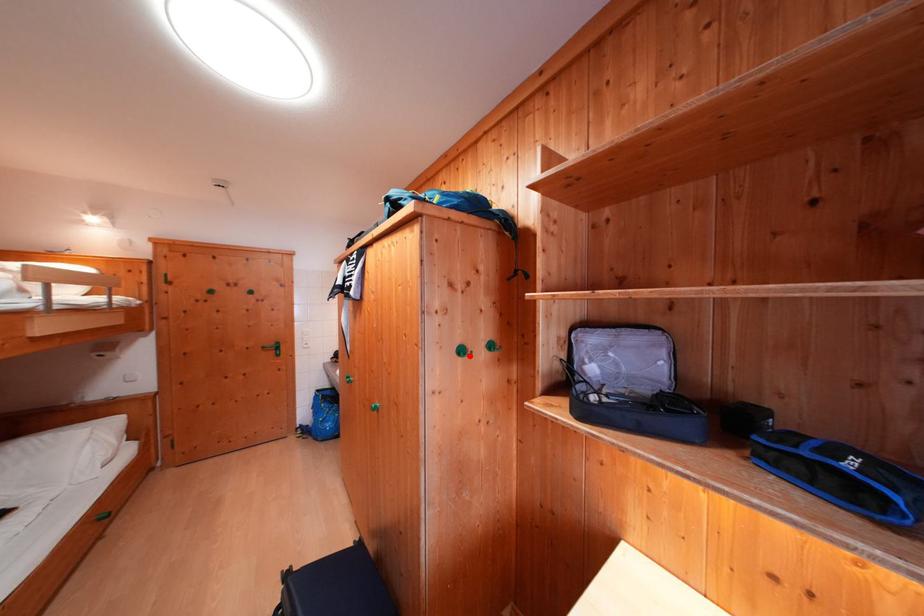
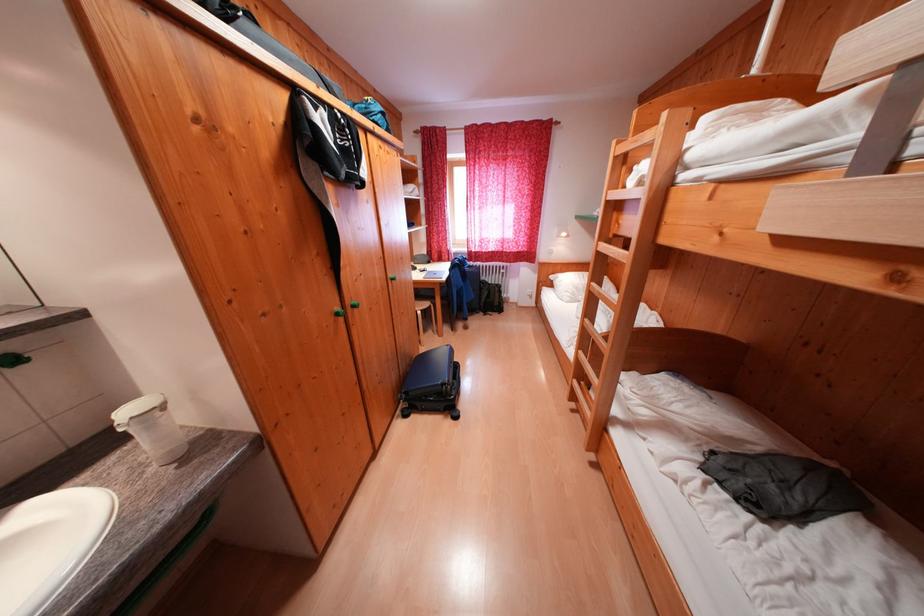
Question: I am providing you with two images of the same scene from different viewpoints. A red point is marked on the first image. Is the red point's position out of view in image 2?

Choices:
 (A) Yes
 (B) No

Answer: (A)